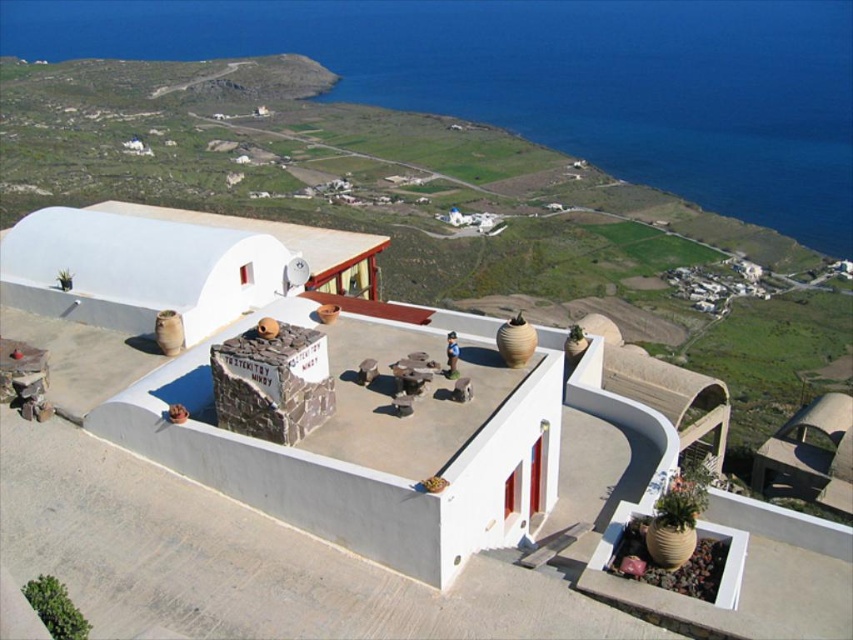
Is white stone hillside at upper center positioned before blue water at upper right?

Yes, it is.

This screenshot has width=853, height=640. I want to click on white stone hillside at upper center, so click(x=416, y=204).